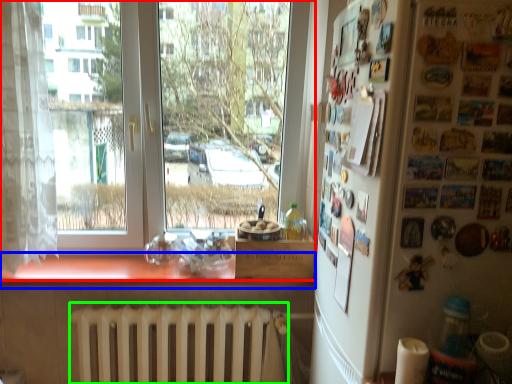
Question: Estimate the real-world distances between objects in this image. Which object is farther from window (highlighted by a red box), counter top (highlighted by a blue box) or radiator (highlighted by a green box)?

Choices:
 (A) counter top
 (B) radiator

Answer: (A)